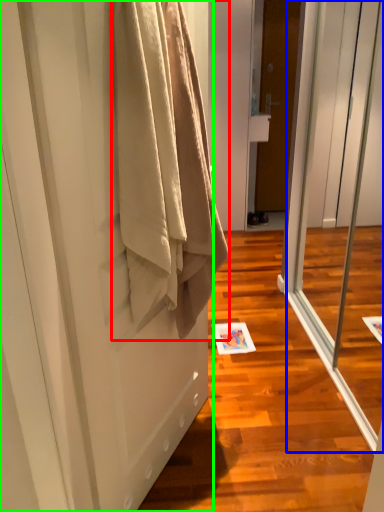
Question: Considering the real-world distances, which object is closest to towel (highlighted by a red box)? screen door (highlighted by a blue box) or door (highlighted by a green box).

Choices:
 (A) screen door
 (B) door

Answer: (B)